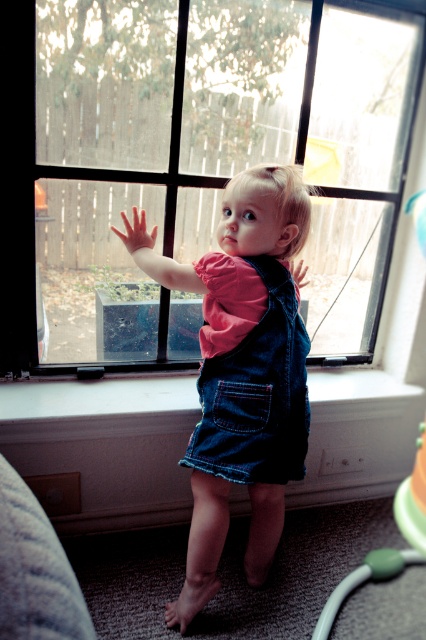
Who is more forward, (319, 385) or (299, 275)?

Point (299, 275) is more forward.

What are the coordinates of `white painted wood at lower center` in the screenshot? It's located at (98, 396).

Does white painted wood at lower center have a lesser width compared to green rubber toy at lower right?

No.

Does white painted wood at lower center have a smaller size compared to green rubber toy at lower right?

Yes, white painted wood at lower center is smaller than green rubber toy at lower right.

Image resolution: width=426 pixels, height=640 pixels. I want to click on white painted wood at lower center, so click(98, 396).

The height and width of the screenshot is (640, 426). In order to click on white painted wood at lower center in this screenshot , I will do `click(98, 396)`.

Can you confirm if denim overall at center is thinner than pink flesh hand at upper center?

No, denim overall at center is not thinner than pink flesh hand at upper center.

Which is behind, point (190, 481) or point (147, 241)?

The point (190, 481) is more distant.

Image resolution: width=426 pixels, height=640 pixels. Identify the location of denim overall at center. pyautogui.click(x=244, y=374).